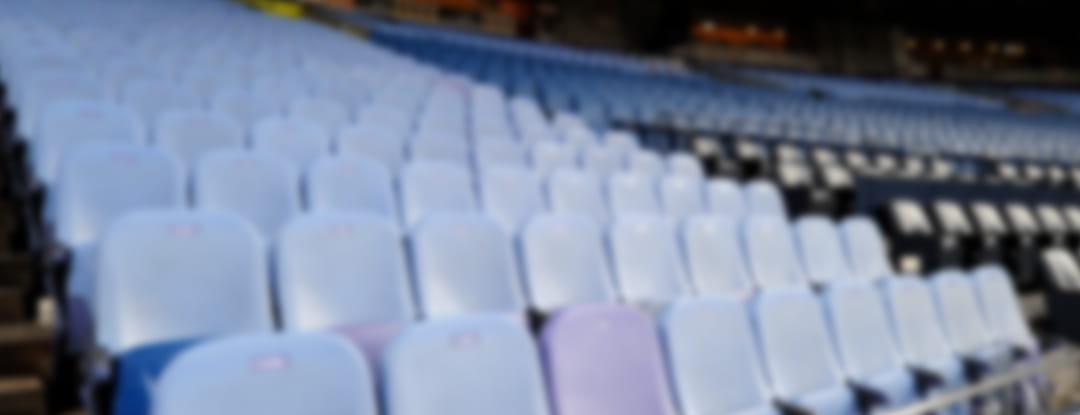
The height and width of the screenshot is (415, 1080). I want to click on seats, so click(792, 335), click(706, 345), click(724, 274), click(777, 252).